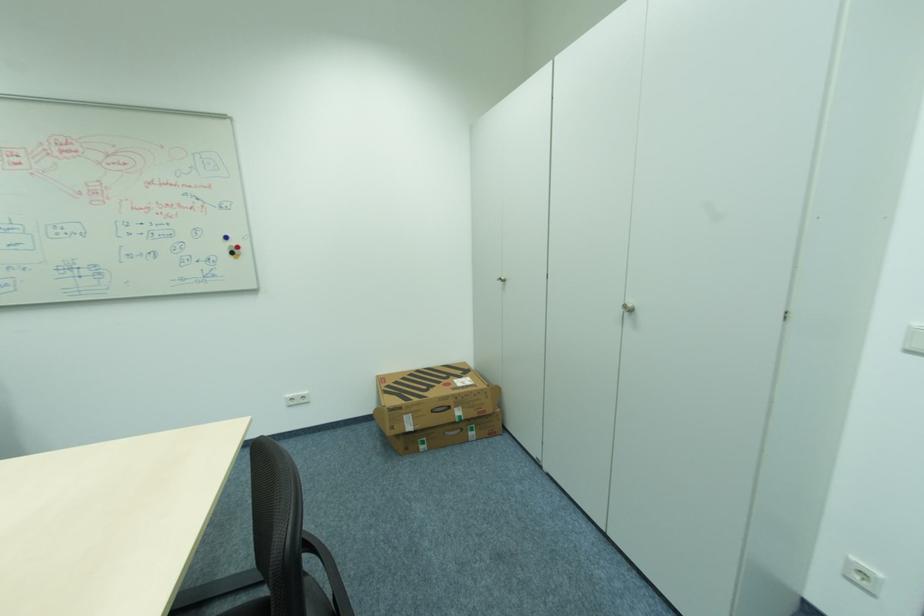
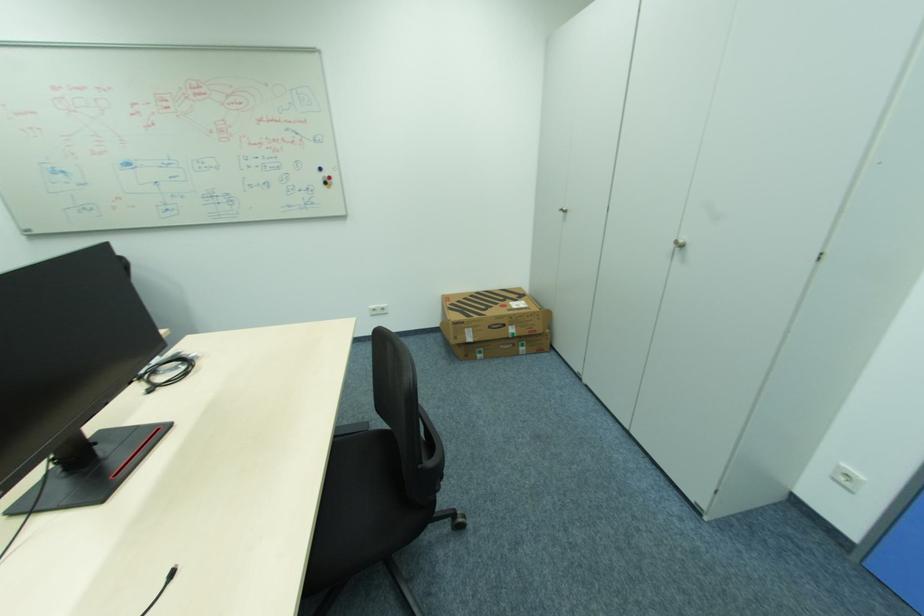
The point at (456, 377) is marked in the first image. Where is the corresponding point in the second image?

(513, 300)